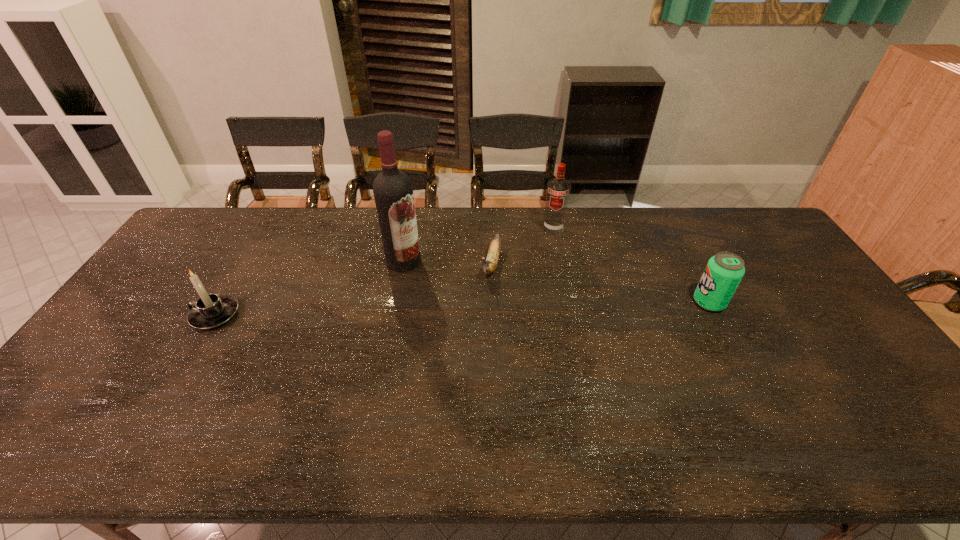
I want to click on vacant area that satisfies the following two spatial constraints: 1. on the front side of the banana; 2. on the front-facing side of the pop soda, so click(492, 302).

Locate an element on the screen. This screenshot has width=960, height=540. free point that satisfies the following two spatial constraints: 1. on the front side of the vodka; 2. on the front-facing side of the rightmost object is located at coordinates (568, 302).